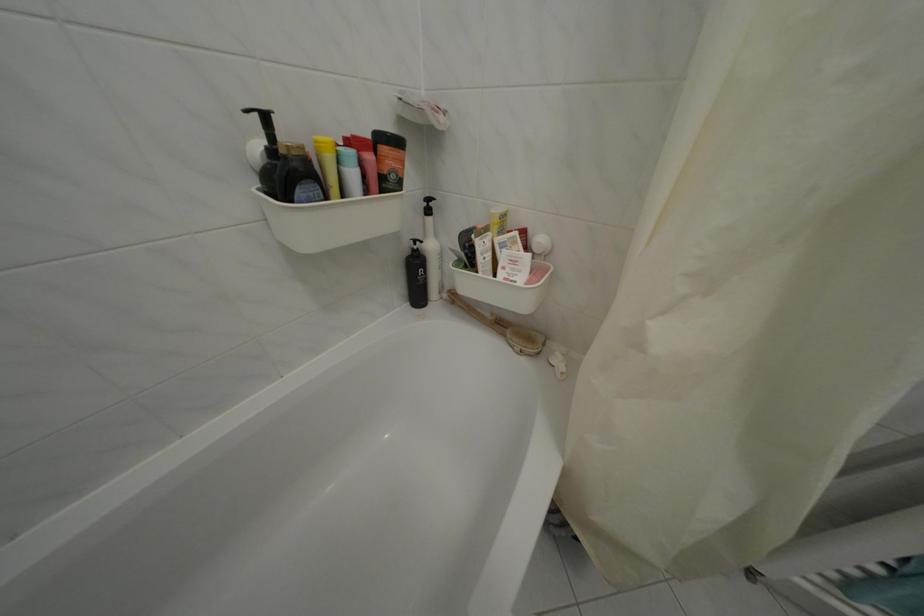
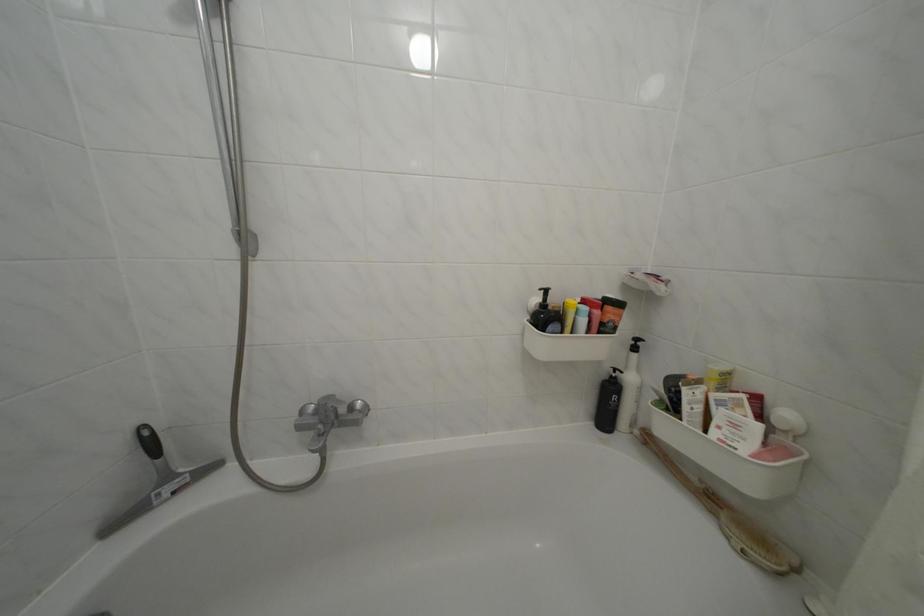
Find the pixel in the second image that matches pixel 538 288 in the first image.

(766, 462)